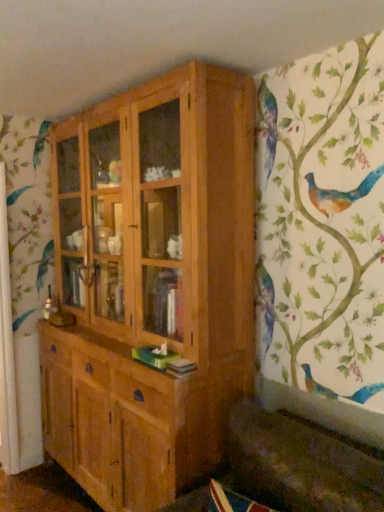
Where is `natural wood cabinet at center`? This screenshot has width=384, height=512. natural wood cabinet at center is located at coordinates (151, 284).

Measure the distance between point (176, 122) and camera.

Point (176, 122) is 2.29 meters away from camera.

The height and width of the screenshot is (512, 384). Describe the element at coordinates (151, 284) in the screenshot. I see `natural wood cabinet at center` at that location.

This screenshot has height=512, width=384. What are the coordinates of `natural wood cabinet at center` in the screenshot? It's located at (151, 284).